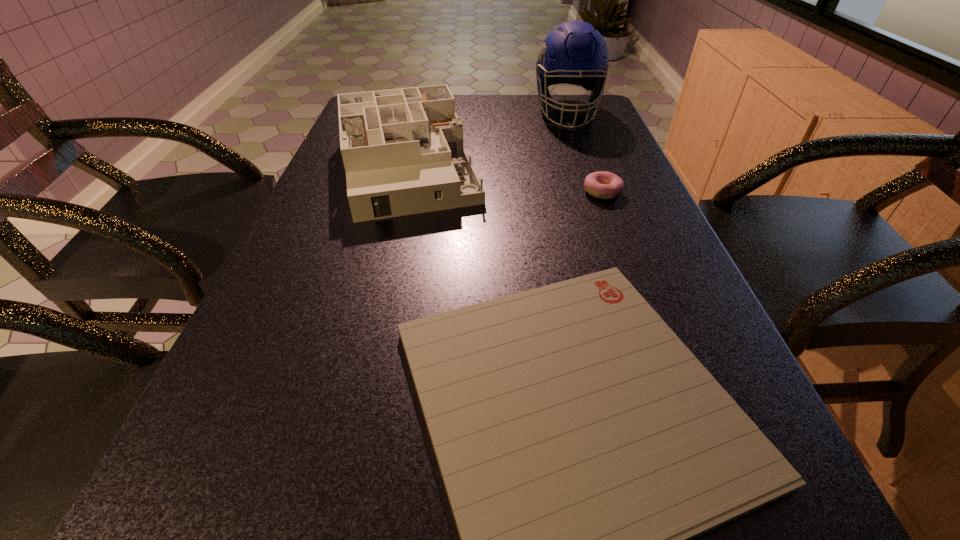
Locate an element on the screen. The height and width of the screenshot is (540, 960). object that is at the far right corner is located at coordinates (575, 53).

At what (x,y) coordinates should I click in order to perform the action: click on free region at the far edge of the desktop. Please return your answer as a coordinate pair (x, y). The image size is (960, 540). Looking at the image, I should click on (530, 104).

The width and height of the screenshot is (960, 540). In the image, there is a desktop. What are the coordinates of `free space at the left edge` in the screenshot? It's located at (328, 254).

The height and width of the screenshot is (540, 960). Identify the location of blank space at the right edge. (607, 207).

Where is `blank space at the near right corner of the desktop`? Image resolution: width=960 pixels, height=540 pixels. blank space at the near right corner of the desktop is located at coordinates (740, 537).

What are the coordinates of `free point between the dollhouse and the doughnut` in the screenshot? It's located at (505, 180).

Identify the location of empty location between the dollhouse and the doughnut. (505, 180).

Locate an element on the screen. The height and width of the screenshot is (540, 960). free spot between the doughnut and the third shortest object is located at coordinates (505, 180).

Find the location of a particular element. Image resolution: width=960 pixels, height=540 pixels. blank region between the second tallest object and the tallest object is located at coordinates (488, 139).

The width and height of the screenshot is (960, 540). I want to click on free point between the doughnut and the dollhouse, so click(x=505, y=180).